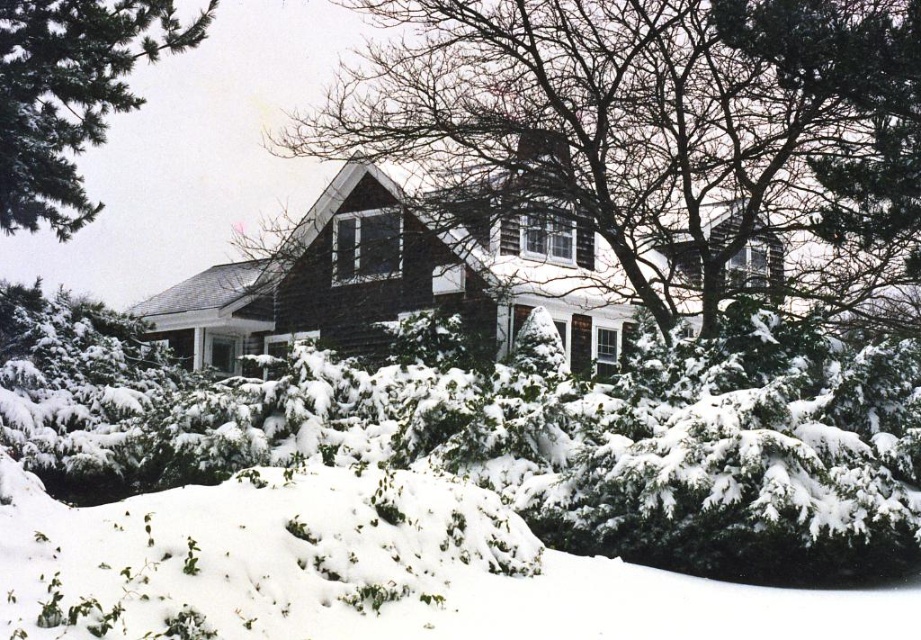
Question: Estimate the real-world distances between objects in this image. Which object is farther from the white fluffy snow at lower center?

Choices:
 (A) green needle-like at upper left
 (B) bare branches at center

Answer: (A)

Question: Where is bare branches at center located in relation to green needle-like at upper left in the image?

Choices:
 (A) left
 (B) right

Answer: (B)

Question: Which object is positioned farthest from the bare branches at center?

Choices:
 (A) green needle-like at upper left
 (B) white fluffy snow at lower center

Answer: (B)

Question: Observing the image, what is the correct spatial positioning of bare branches at center in reference to white fluffy snow at lower center?

Choices:
 (A) below
 (B) above

Answer: (B)

Question: Is the position of bare branches at center less distant than that of white fluffy snow at lower center?

Choices:
 (A) no
 (B) yes

Answer: (A)

Question: Which point appears closest to the camera in this image?

Choices:
 (A) (348, 100)
 (B) (243, 595)

Answer: (B)